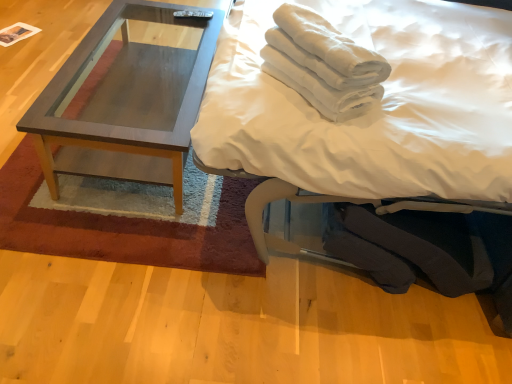
Question: Can you confirm if wooden coffee table at center is shorter than white cotton towels at upper right?

Choices:
 (A) no
 (B) yes

Answer: (B)

Question: Considering the relative sizes of wooden coffee table at center and white cotton towels at upper right in the image provided, is wooden coffee table at center thinner than white cotton towels at upper right?

Choices:
 (A) yes
 (B) no

Answer: (B)

Question: Considering the relative sizes of wooden coffee table at center and white cotton towels at upper right in the image provided, is wooden coffee table at center taller than white cotton towels at upper right?

Choices:
 (A) no
 (B) yes

Answer: (A)

Question: Can you confirm if wooden coffee table at center is wider than white cotton towels at upper right?

Choices:
 (A) yes
 (B) no

Answer: (A)

Question: Is wooden coffee table at center aimed at white cotton towels at upper right?

Choices:
 (A) no
 (B) yes

Answer: (A)

Question: Considering their positions, is matte wood coffee table at left located in front of or behind white soft bed at upper right?

Choices:
 (A) front
 (B) behind

Answer: (B)

Question: From the image's perspective, is matte wood coffee table at left located above or below white soft bed at upper right?

Choices:
 (A) below
 (B) above

Answer: (B)

Question: From a real-world perspective, is matte wood coffee table at left above or below white soft bed at upper right?

Choices:
 (A) below
 (B) above

Answer: (A)

Question: Do you think matte wood coffee table at left is within white soft bed at upper right, or outside of it?

Choices:
 (A) inside
 (B) outside

Answer: (B)

Question: Is point (315, 34) positioned closer to the camera than point (84, 44)?

Choices:
 (A) farther
 (B) closer

Answer: (B)

Question: In the image, is white cotton towels at upper right positioned in front of or behind matte wood coffee table at left?

Choices:
 (A) behind
 (B) front

Answer: (B)

Question: From a real-world perspective, relative to matte wood coffee table at left, is white cotton towels at upper right vertically above or below?

Choices:
 (A) below
 (B) above

Answer: (B)

Question: From their relative heights in the image, would you say white cotton towels at upper right is taller or shorter than matte wood coffee table at left?

Choices:
 (A) short
 (B) tall

Answer: (A)

Question: Do you think matte wood coffee table at left is within white cotton towels at upper right, or outside of it?

Choices:
 (A) inside
 (B) outside

Answer: (B)

Question: Is matte wood coffee table at left in front of or behind white cotton towels at upper right in the image?

Choices:
 (A) behind
 (B) front

Answer: (A)